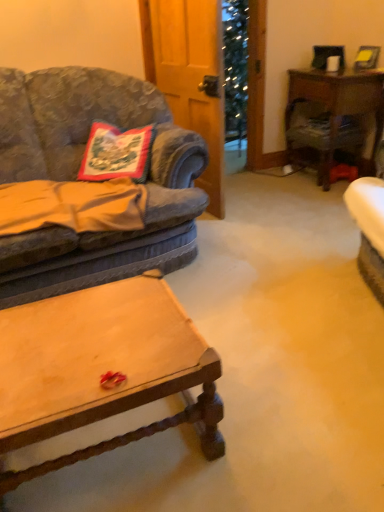
Question: Is wooden desk at right shorter than velvet fabric couch at left?

Choices:
 (A) yes
 (B) no

Answer: (A)

Question: From the image's perspective, is wooden desk at right located beneath velvet fabric couch at left?

Choices:
 (A) yes
 (B) no

Answer: (B)

Question: Considering the relative positions of wooden desk at right and velvet fabric couch at left in the image provided, is wooden desk at right to the left of velvet fabric couch at left from the viewer's perspective?

Choices:
 (A) yes
 (B) no

Answer: (B)

Question: From a real-world perspective, does wooden desk at right sit lower than velvet fabric couch at left?

Choices:
 (A) yes
 (B) no

Answer: (A)

Question: Is wooden desk at right outside of velvet fabric couch at left?

Choices:
 (A) yes
 (B) no

Answer: (A)

Question: Is wooden desk at right bigger or smaller than embroidered fabric pillow at left?

Choices:
 (A) big
 (B) small

Answer: (A)

Question: From the image's perspective, is wooden desk at right above or below embroidered fabric pillow at left?

Choices:
 (A) above
 (B) below

Answer: (A)

Question: Choose the correct answer: Is wooden desk at right inside embroidered fabric pillow at left or outside it?

Choices:
 (A) outside
 (B) inside

Answer: (A)

Question: Is point (345, 99) closer or farther from the camera than point (102, 159)?

Choices:
 (A) farther
 (B) closer

Answer: (A)

Question: Considering their positions, is wooden desk at right located in front of or behind wooden coffee table at center?

Choices:
 (A) behind
 (B) front

Answer: (A)

Question: Is wooden desk at right taller or shorter than wooden coffee table at center?

Choices:
 (A) tall
 (B) short

Answer: (A)

Question: Is point (332, 143) closer or farther from the camera than point (145, 426)?

Choices:
 (A) closer
 (B) farther

Answer: (B)

Question: Considering the positions of wooden desk at right and wooden coffee table at center in the image, is wooden desk at right wider or thinner than wooden coffee table at center?

Choices:
 (A) thin
 (B) wide

Answer: (A)

Question: Relative to wooden desk at right, is wooden coffee table at center in front or behind?

Choices:
 (A) front
 (B) behind

Answer: (A)

Question: Is wooden coffee table at center spatially inside wooden desk at right, or outside of it?

Choices:
 (A) inside
 (B) outside

Answer: (B)